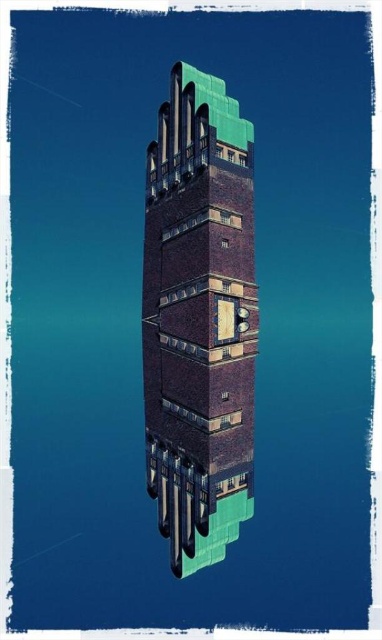
Consider the image. Who is positioned more to the left, brown brick tower at center or green glossy pipes at lower center?

green glossy pipes at lower center

Looking at this image, is brown brick tower at center thinner than green glossy pipes at lower center?

In fact, brown brick tower at center might be wider than green glossy pipes at lower center.

Locate an element on the screen. brown brick tower at center is located at coordinates (200, 320).